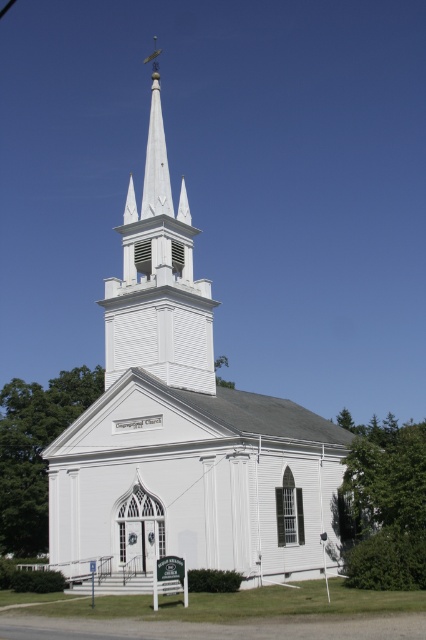
Which is above, white wooden church at center or white wooden steeple at center?

white wooden church at center is above.

Measure the distance between point (317, 444) and camera.

Point (317, 444) is 169.57 feet away from camera.

This screenshot has height=640, width=426. What are the coordinates of `white wooden church at center` in the screenshot? It's located at pyautogui.click(x=184, y=428).